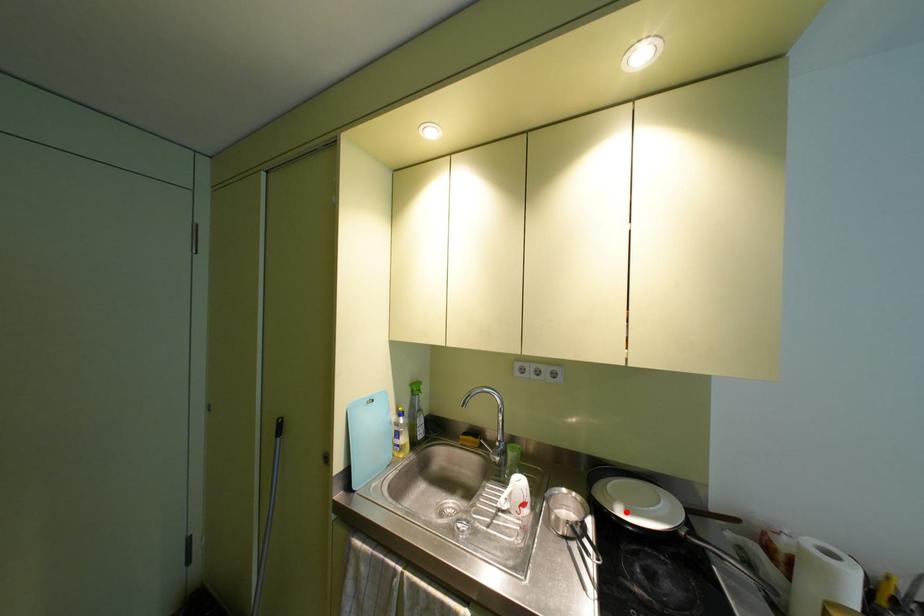
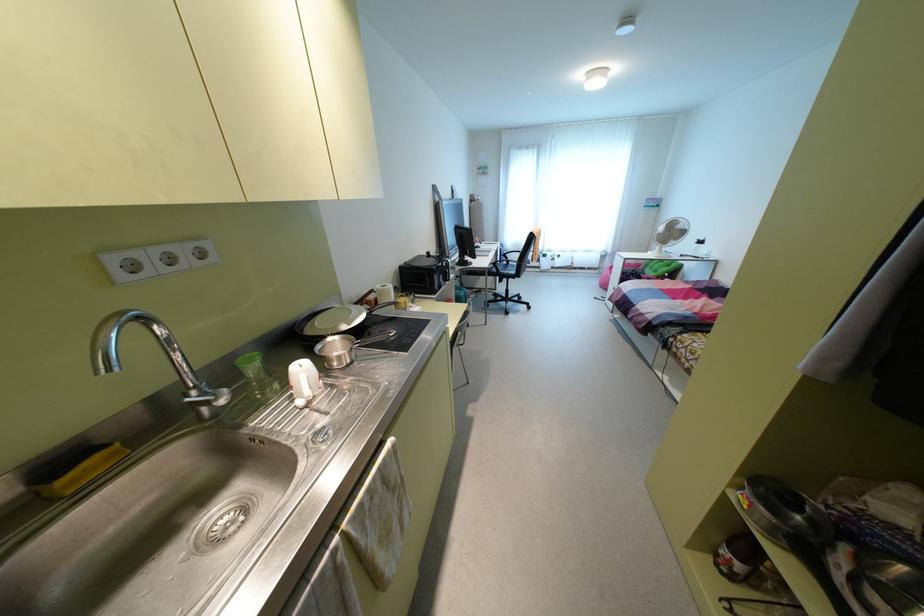
In the second image, find the point that corresponds to the highlighted location in the first image.

(348, 323)